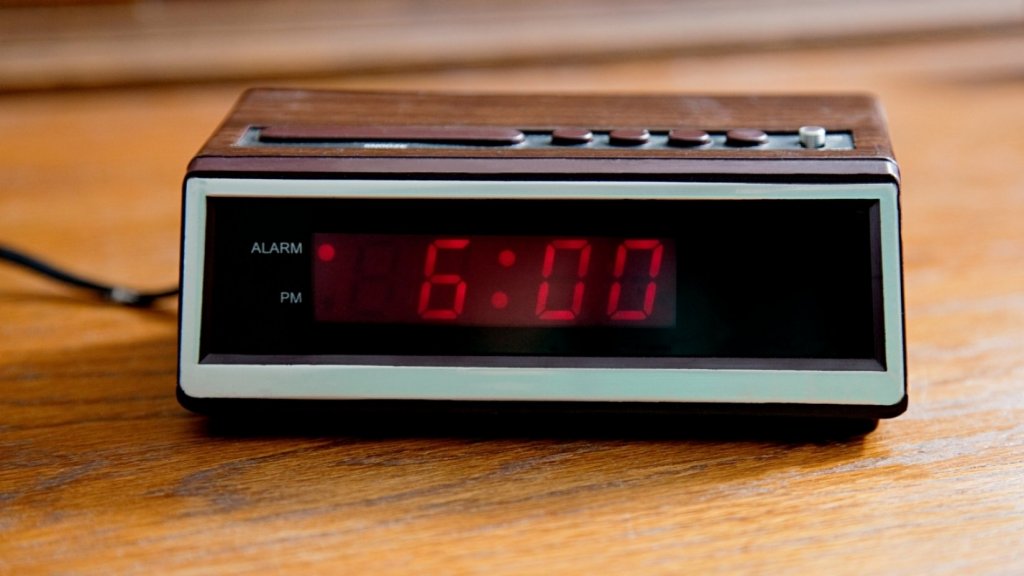
Locate an element on the screen. digital area of clock where time appears is located at coordinates coord(395,281).